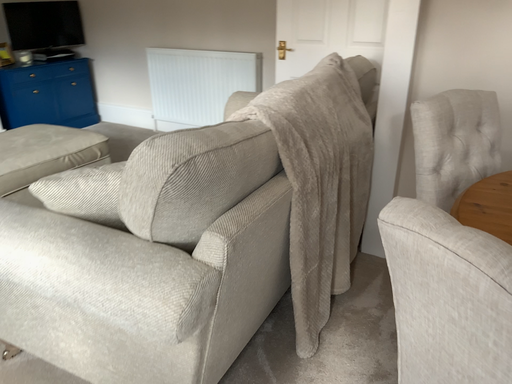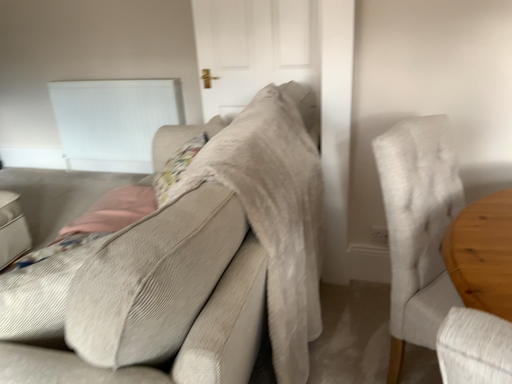
Question: Which way did the camera rotate in the video?

Choices:
 (A) rotated right
 (B) rotated left

Answer: (A)